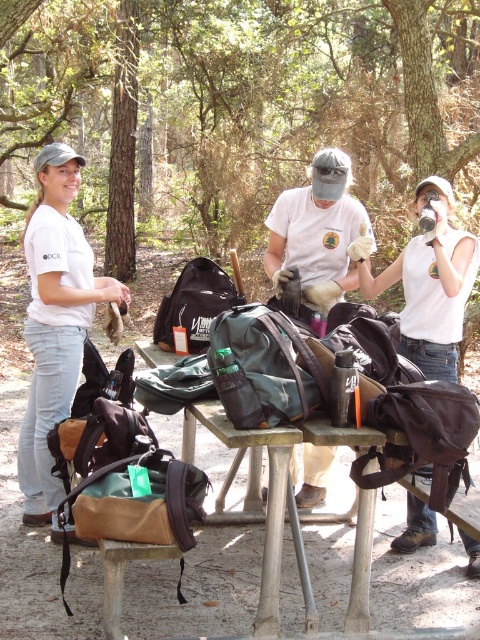
Question: From the image, what is the correct spatial relationship of white matte t-shirt at center in relation to metallic silver table at center?

Choices:
 (A) right
 (B) left

Answer: (B)

Question: Is white matte t-shirt at center closer to camera compared to matte black backpack at center?

Choices:
 (A) no
 (B) yes

Answer: (B)

Question: Is matte white t-shirt at left in front of matte black backpack at center?

Choices:
 (A) no
 (B) yes

Answer: (B)

Question: Among these objects, which one is nearest to the camera?

Choices:
 (A) white matte t-shirt at center
 (B) matte black backpack at center
 (C) green fabric backpack at center

Answer: (C)

Question: Which point is closer to the camera?

Choices:
 (A) (36, 323)
 (B) (204, 321)
 (C) (247, 390)

Answer: (C)

Question: Which point is farther from the camera taking this photo?

Choices:
 (A) (211, 368)
 (B) (330, 262)

Answer: (B)